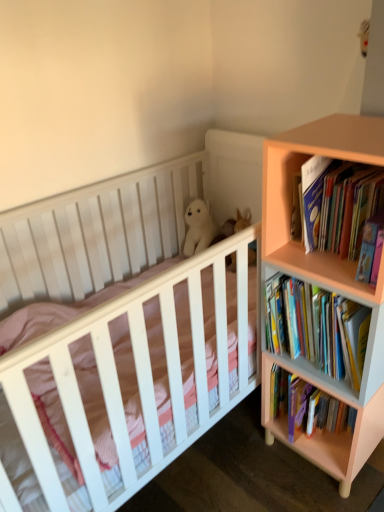
Question: Is white matte crib at center oriented towards pink matte bookcase at right?

Choices:
 (A) no
 (B) yes

Answer: (B)

Question: From the image's perspective, would you say white matte crib at center is shown under pink matte bookcase at right?

Choices:
 (A) no
 (B) yes

Answer: (B)

Question: Does white matte crib at center have a lesser width compared to pink matte bookcase at right?

Choices:
 (A) no
 (B) yes

Answer: (A)

Question: From a real-world perspective, is white matte crib at center physically below pink matte bookcase at right?

Choices:
 (A) yes
 (B) no

Answer: (A)

Question: Does white matte crib at center appear on the left side of pink matte bookcase at right?

Choices:
 (A) no
 (B) yes

Answer: (B)

Question: Considering the positions of white matte crib at center and pink matte bookcase at right in the image, is white matte crib at center bigger or smaller than pink matte bookcase at right?

Choices:
 (A) big
 (B) small

Answer: (A)

Question: From the image's perspective, is white matte crib at center above or below pink matte bookcase at right?

Choices:
 (A) below
 (B) above

Answer: (A)

Question: Based on their positions, is white matte crib at center located to the left or right of pink matte bookcase at right?

Choices:
 (A) left
 (B) right

Answer: (A)

Question: Is white matte crib at center wider or thinner than pink matte bookcase at right?

Choices:
 (A) wide
 (B) thin

Answer: (A)

Question: Looking at the image, does pink matte bookcase at right seem bigger or smaller compared to white plush bear at upper center?

Choices:
 (A) small
 (B) big

Answer: (B)

Question: Would you say pink matte bookcase at right is inside or outside white plush bear at upper center?

Choices:
 (A) outside
 (B) inside

Answer: (A)

Question: Visually, is pink matte bookcase at right positioned to the left or to the right of white plush bear at upper center?

Choices:
 (A) left
 (B) right

Answer: (B)

Question: In terms of height, does pink matte bookcase at right look taller or shorter compared to white plush bear at upper center?

Choices:
 (A) short
 (B) tall

Answer: (B)

Question: Is hardcover books at right, placed as the 1th book when sorted from bottom to top, spatially inside pink matte bookcase at right, or outside of it?

Choices:
 (A) inside
 (B) outside

Answer: (A)

Question: Is hardcover books at right, the second book from the top, wider or thinner than pink matte bookcase at right?

Choices:
 (A) thin
 (B) wide

Answer: (A)